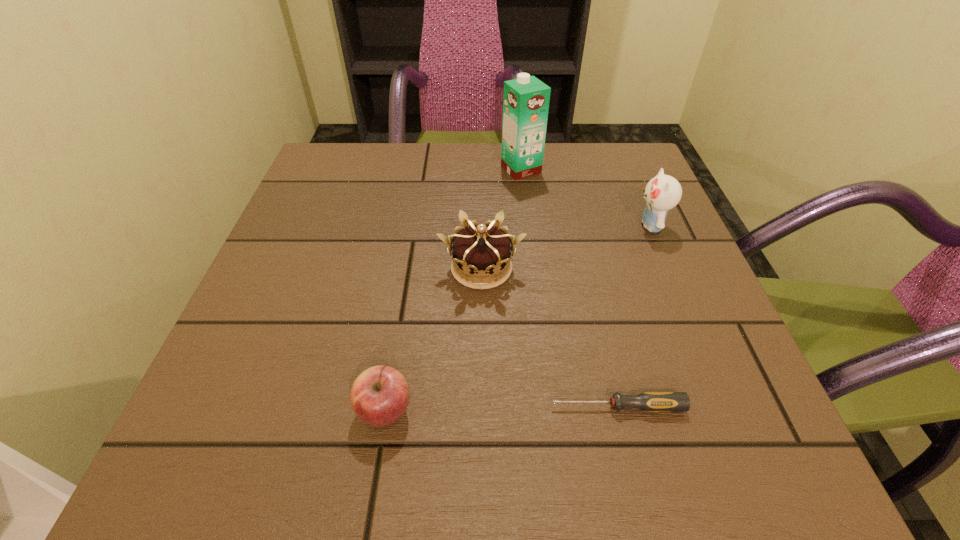
Where is `free space at the far edge of the desktop`? The height and width of the screenshot is (540, 960). free space at the far edge of the desktop is located at coordinates (419, 185).

Where is `vacant space at the near edge of the desktop`? This screenshot has height=540, width=960. vacant space at the near edge of the desktop is located at coordinates (336, 445).

Identify the location of vacant space at the left edge. (302, 329).

Find the location of a particular element. Image resolution: width=960 pixels, height=540 pixels. vacant space at the right edge of the desktop is located at coordinates (666, 369).

Identify the location of free space at the far left corner. (370, 191).

Find the location of `free spot at the near right corner of the desktop`. free spot at the near right corner of the desktop is located at coordinates click(x=768, y=456).

I want to click on free space between the tallest object and the shortest object, so click(569, 288).

I want to click on unoccupied area between the shortest object and the crown, so click(x=549, y=338).

Where is `free spot between the rightmost object and the shortest object`? The width and height of the screenshot is (960, 540). free spot between the rightmost object and the shortest object is located at coordinates (634, 316).

Locate an element on the screen. The height and width of the screenshot is (540, 960). free space between the shortest object and the kitten is located at coordinates (634, 316).